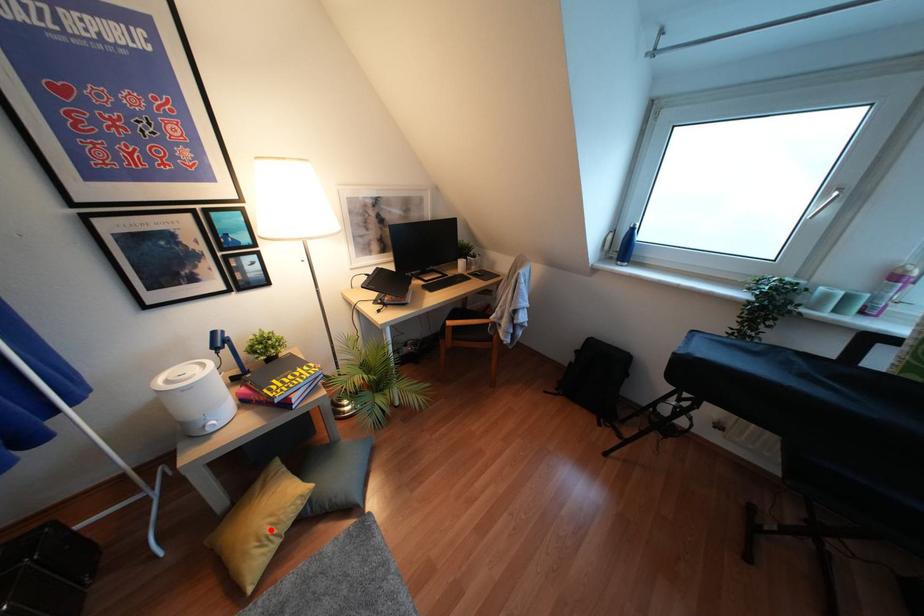
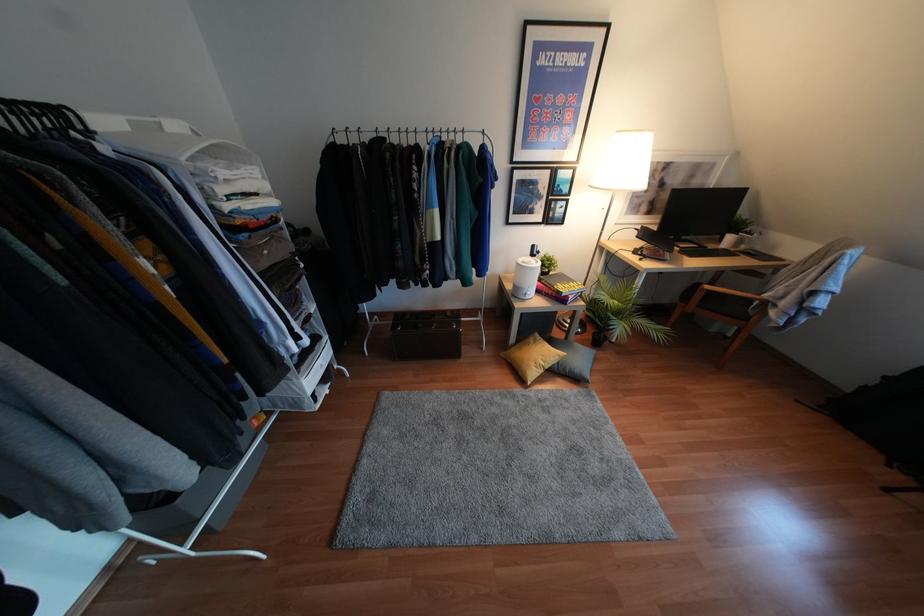
Question: I am providing you with two images of the same scene from different viewpoints. A red point is shown in image1. For the corresponding object point in image2, is it positioned nearer or farther from the camera?

Choices:
 (A) Nearer
 (B) Farther

Answer: (B)